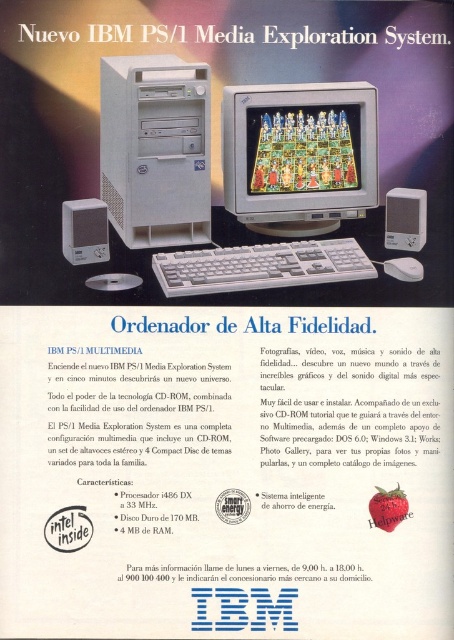
You are setting up the Nuevo IBM PS1 Media Exploration System and need to place the matte plastic monitor at center and the white plastic mouse at lower right on a desk. If the desk has a width of 1 meter, can both items fit side by side without overlapping?

The matte plastic monitor at center is wider than the white plastic mouse at lower right. However, without knowing the exact widths of both items, it is impossible to determine if they can fit side by side on a 1 meter desk.